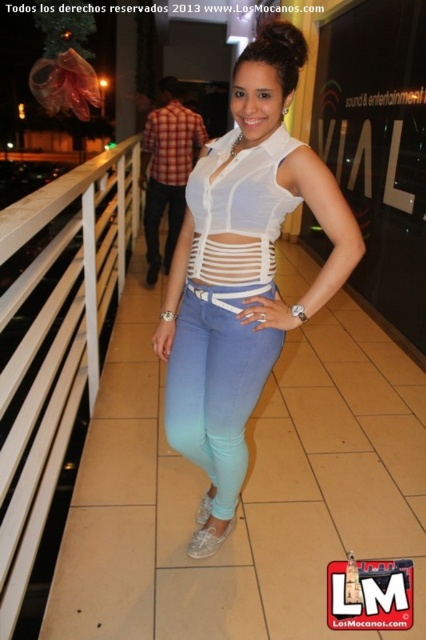
You are standing at the camera position and want to know how far the point at coordinates (183, 301) is from you in feet. Can you determine the distance?

The point at coordinates (183, 301) is 5.28 feet away from the camera position.

You are a painter who wants to paint the white matte top at center and the white wood rail at left. Which object requires more paint because it has a larger width?

The white wood rail at left requires more paint because it is wider than the white matte top at center.